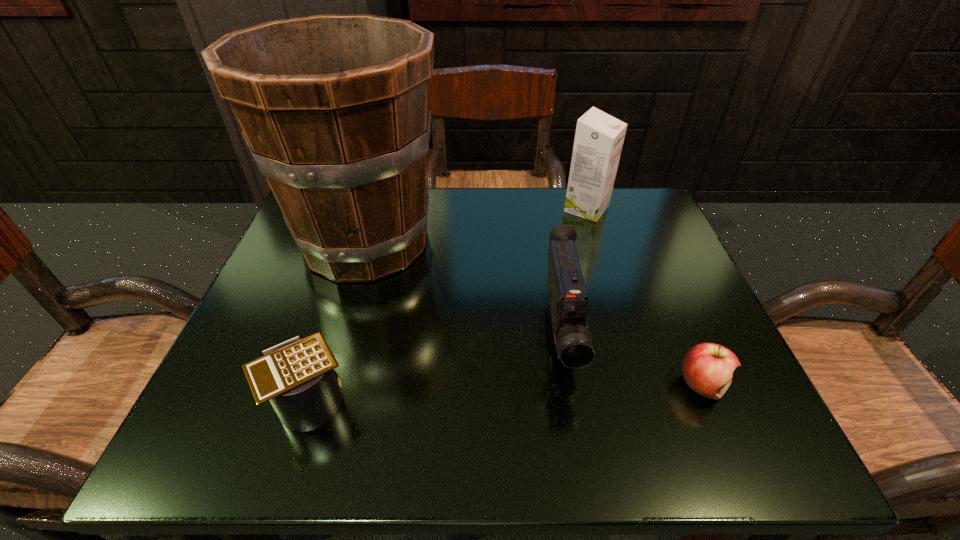
Locate an element on the screen. The height and width of the screenshot is (540, 960). free space located on the front-facing side of the third tallest object is located at coordinates (577, 431).

Identify the location of free location located on the left of the second shortest object. (230, 400).

This screenshot has width=960, height=540. I want to click on free point located 0.300m on the left of the rightmost object, so click(x=500, y=384).

Identify the location of bucket that is at the far edge. The height and width of the screenshot is (540, 960). (335, 109).

You are a GUI agent. You are given a task and a screenshot of the screen. Output one action in this format:
    pyautogui.click(x=<x>, y=<y>)
    Task: Click on the carton that is at the far edge
    This screenshot has height=540, width=960.
    Given the screenshot: What is the action you would take?
    pyautogui.click(x=599, y=137)

What are the coordinates of `calculator located at the near edge` in the screenshot? It's located at (297, 376).

At what (x,y) coordinates should I click in order to perform the action: click on apple that is at the near edge. Please return your answer as a coordinate pair (x, y). This screenshot has width=960, height=540. Looking at the image, I should click on (707, 368).

Locate an element on the screen. This screenshot has height=540, width=960. bucket present at the left edge is located at coordinates (335, 109).

Where is `calculator that is at the left edge`? This screenshot has height=540, width=960. calculator that is at the left edge is located at coordinates click(297, 376).

At what (x,y) coordinates should I click in order to perform the action: click on carton that is at the right edge. Please return your answer as a coordinate pair (x, y). Looking at the image, I should click on (599, 137).